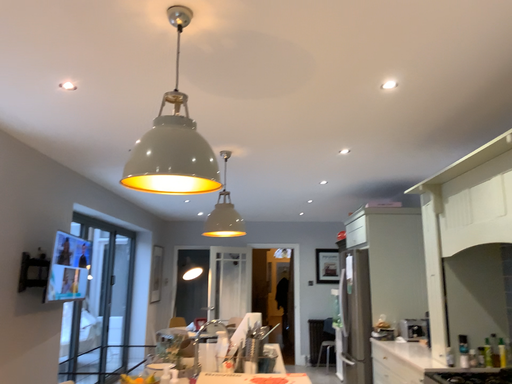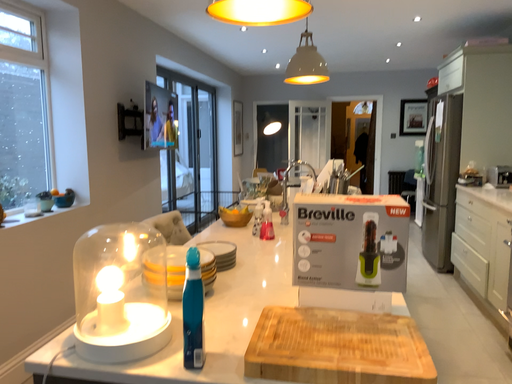
Question: How did the camera likely rotate when shooting the video?

Choices:
 (A) rotated upward
 (B) rotated downward

Answer: (B)